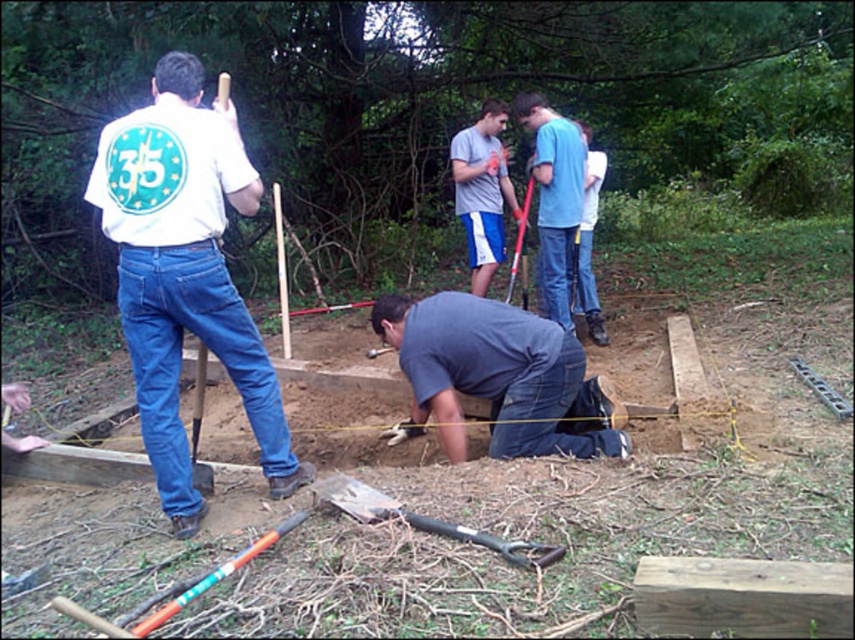
Question: In this image, where is metallic black shovel at lower center located relative to brushed metal shovel at lower center?

Choices:
 (A) left
 (B) right

Answer: (B)

Question: Which of the following is the closest to the observer?

Choices:
 (A) gray cotton shirt at center
 (B) metallic black shovel at lower center
 (C) blue jeans at center

Answer: (B)

Question: Which point is farther from the camera taking this photo?

Choices:
 (A) (500, 243)
 (B) (201, 467)
 (C) (404, 518)

Answer: (A)

Question: Can you confirm if blue jeans at center is positioned to the right of metallic black shovel at lower center?

Choices:
 (A) no
 (B) yes

Answer: (B)

Question: Which object appears closest to the camera in this image?

Choices:
 (A) metallic black shovel at lower center
 (B) white matte shirt at left
 (C) gray cotton shirt at center
 (D) dark gray shirt at center

Answer: (A)

Question: Can you confirm if blue jeans at center is positioned to the right of metallic black shovel at lower center?

Choices:
 (A) no
 (B) yes

Answer: (B)